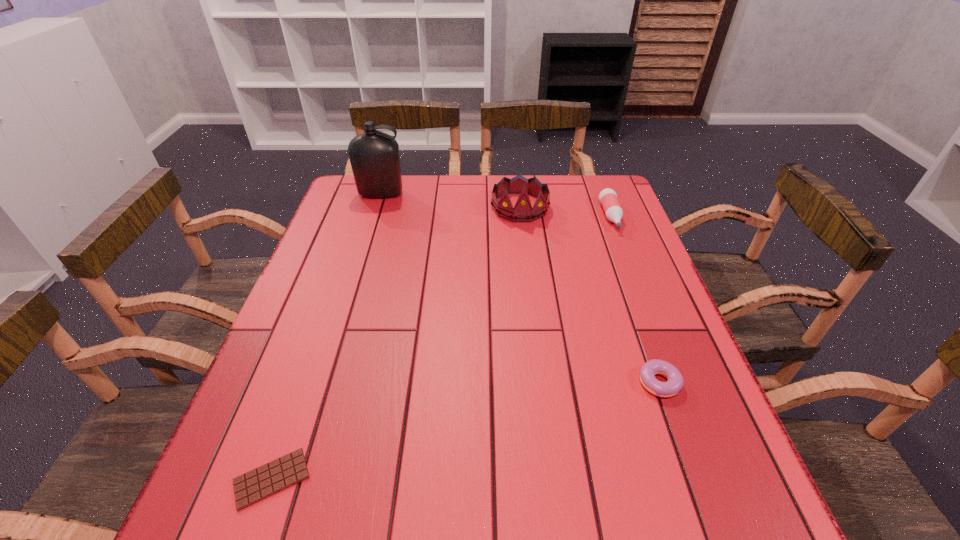
Image resolution: width=960 pixels, height=540 pixels. I want to click on free space in the image that satisfies the following two spatial constraints: 1. at the front of the doughnut with jewels; 2. on the right side of the tiara, so click(x=541, y=383).

In order to click on vacant area in the image that satisfies the following two spatial constraints: 1. at the front of the third object from left to right with jewels; 2. on the left side of the second nearest object in this screenshot , I will do `click(541, 383)`.